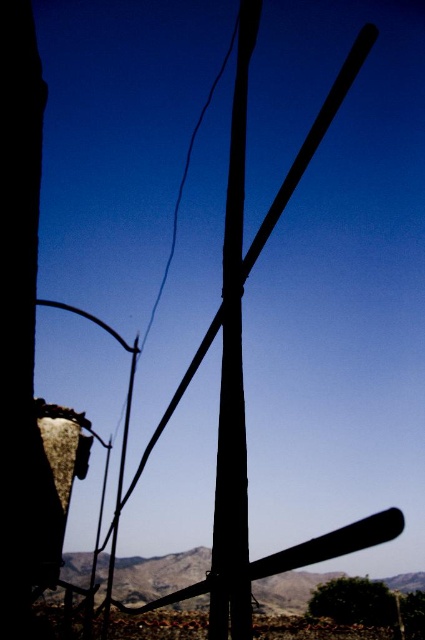
Between smooth wood pole at center and green leafy tree at lower center, which one is positioned lower?

green leafy tree at lower center is lower down.

Image resolution: width=425 pixels, height=640 pixels. Identify the location of smooth wood pole at center. (232, 380).

The height and width of the screenshot is (640, 425). I want to click on smooth wood pole at center, so click(x=232, y=380).